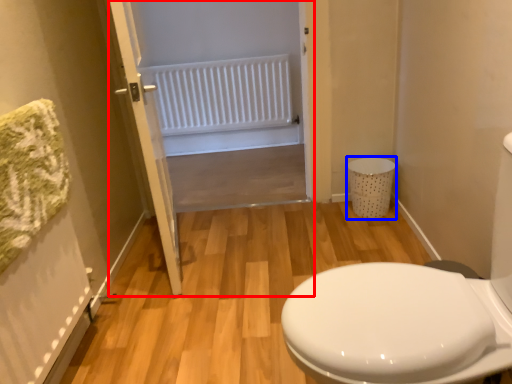
Question: Which object is further to the camera taking this photo, screen door (highlighted by a red box) or laundry basket (highlighted by a blue box)?

Choices:
 (A) screen door
 (B) laundry basket

Answer: (B)